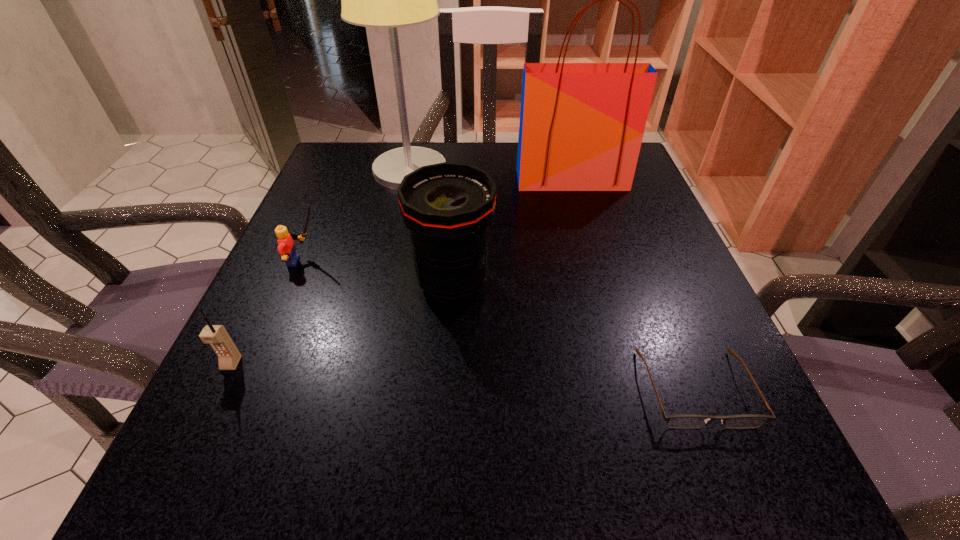
The width and height of the screenshot is (960, 540). I want to click on object at the far right corner, so (581, 127).

You are a GUI agent. You are given a task and a screenshot of the screen. Output one action in this format:
    pyautogui.click(x=<x>, y=<y>)
    Task: Click on the vacant space at the near edge of the desktop
    This screenshot has height=540, width=960.
    Given the screenshot: What is the action you would take?
    pyautogui.click(x=347, y=507)

The height and width of the screenshot is (540, 960). In the image, there is a desktop. Identify the location of vacant space at the left edge. click(375, 228).

Image resolution: width=960 pixels, height=540 pixels. In the image, there is a desktop. Find the location of `free space at the right edge`. free space at the right edge is located at coordinates (634, 274).

Where is `vacant space at the far left corner of the desktop`? vacant space at the far left corner of the desktop is located at coordinates (324, 189).

You are a GUI agent. You are given a task and a screenshot of the screen. Output one action in this format:
    pyautogui.click(x=<x>, y=<y>)
    Task: Click on the vacant point located between the spectacles and the third tallest object
    The image size is (960, 540).
    Given the screenshot: What is the action you would take?
    pyautogui.click(x=574, y=335)

Identify the location of unoccupied position between the cellular telephone and the tallest object. The image size is (960, 540). (321, 267).

Locate an element on the screen. Image resolution: width=960 pixels, height=540 pixels. free space between the shortest object and the leftmost object is located at coordinates (464, 375).

Locate an element on the screen. The width and height of the screenshot is (960, 540). free space between the tallest object and the leftmost object is located at coordinates (321, 267).

I want to click on free point between the fifth shortest object and the shortest object, so click(634, 284).